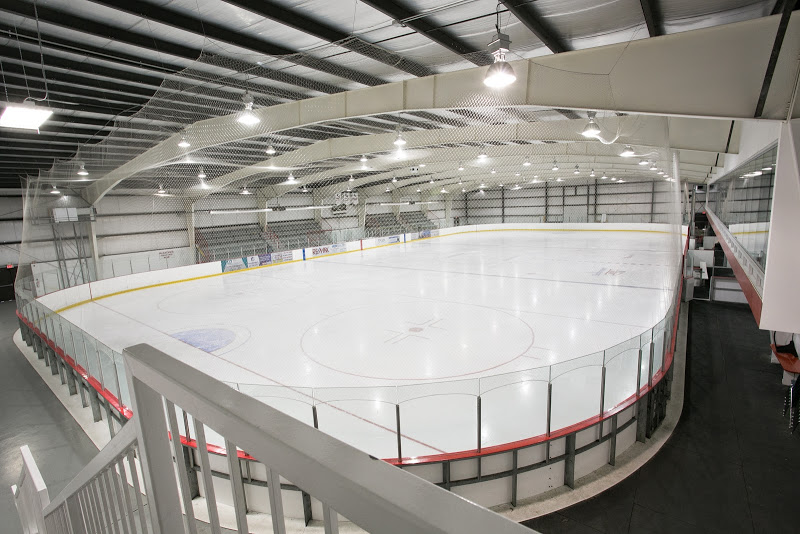
You are a GUI agent. You are given a task and a screenshot of the screen. Output one action in this format:
    pyautogui.click(x=<x>, y=<y>)
    Task: Click on the black floor
    The image size is (800, 534).
    Given the screenshot: What is the action you would take?
    pyautogui.click(x=750, y=474)